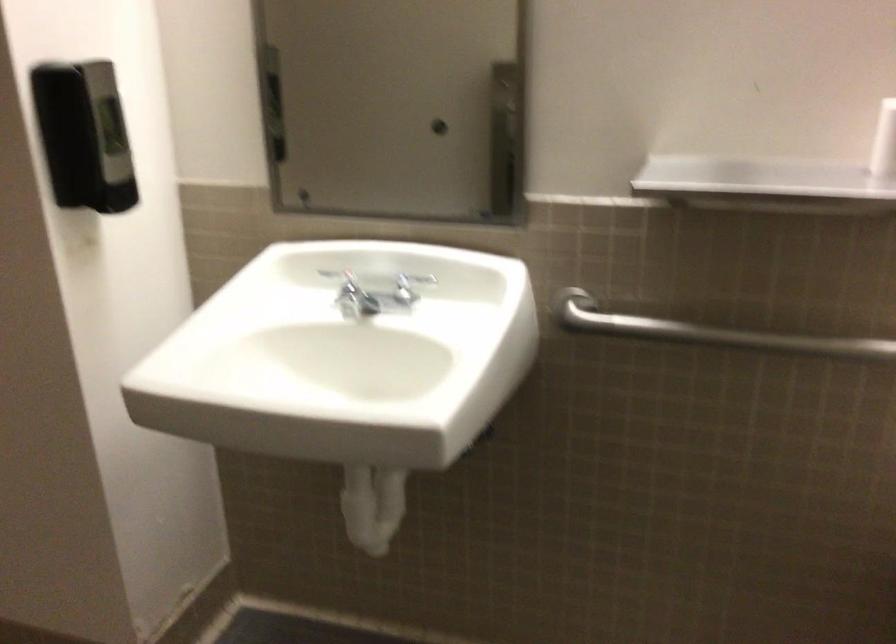
Image resolution: width=896 pixels, height=644 pixels. What do you see at coordinates (707, 332) in the screenshot?
I see `the metal grab bar` at bounding box center [707, 332].